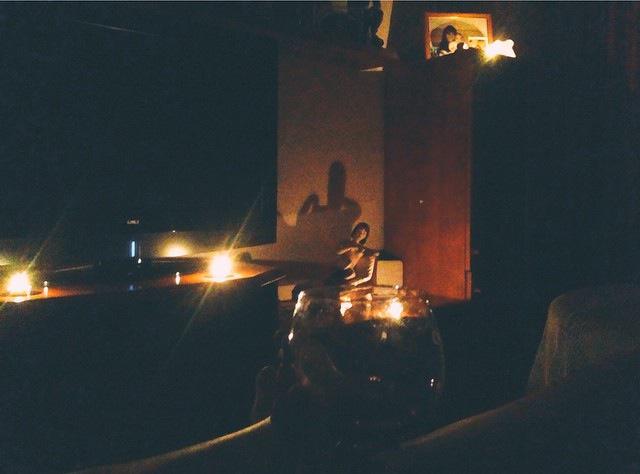
Where is `wooden picture frame`? The width and height of the screenshot is (640, 474). wooden picture frame is located at coordinates (431, 13).